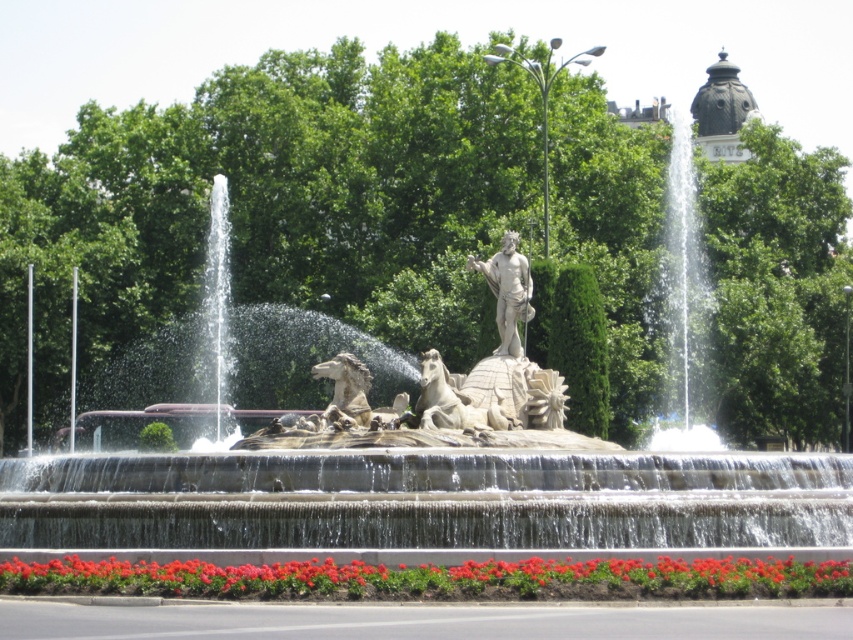
Between point (514, 588) and point (523, 256), which one is positioned in front?

Point (514, 588) is in front.

Who is more forward, (164,588) or (514,337)?

Point (164,588) is more forward.

The width and height of the screenshot is (853, 640). Find the location of `red glossy flowers at lower center`. red glossy flowers at lower center is located at coordinates (434, 579).

In the scene shown: Is stone fountain at center smaller than red glossy flowers at lower center?

Incorrect, stone fountain at center is not smaller in size than red glossy flowers at lower center.

The height and width of the screenshot is (640, 853). Identify the location of stone fountain at center. (426, 499).

Locate an element on the screen. The image size is (853, 640). stone fountain at center is located at coordinates (426, 499).

Can you confirm if red glossy flowers at lower center is positioned to the right of polished stone horse at center?

Yes, red glossy flowers at lower center is to the right of polished stone horse at center.

Is point (263, 588) positioned before point (364, 385)?

Yes, it is.

Locate an element on the screen. This screenshot has height=640, width=853. red glossy flowers at lower center is located at coordinates (434, 579).